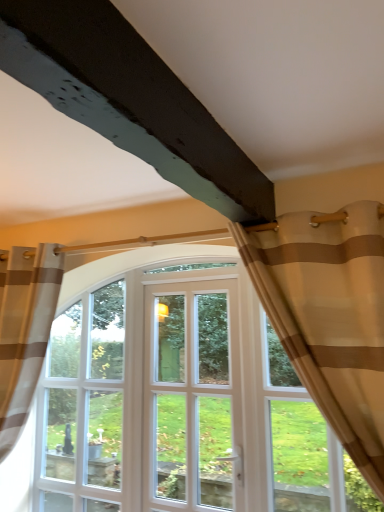
Question: Considering the positions of beige striped curtain at upper right, which is the first curtain from right to left, and brown striped curtain at left, positioned as the 2th curtain in right-to-left order, in the image, is beige striped curtain at upper right, which is the first curtain from right to left, wider or thinner than brown striped curtain at left, positioned as the 2th curtain in right-to-left order,?

Choices:
 (A) wide
 (B) thin

Answer: (B)

Question: Is point (375, 326) positioned closer to the camera than point (21, 306)?

Choices:
 (A) farther
 (B) closer

Answer: (B)

Question: Considering the real-world distances, which object is closest to the brown striped curtain at left, acting as the first curtain starting from the left?

Choices:
 (A) white glass door at center
 (B) beige striped curtain at upper right, which is the second curtain in back-to-front order

Answer: (A)

Question: Which of these objects is positioned closest to the white glass door at center?

Choices:
 (A) brown striped curtain at left, positioned as the 2th curtain in front-to-back order
 (B) beige striped curtain at upper right, the second curtain viewed from the left

Answer: (A)